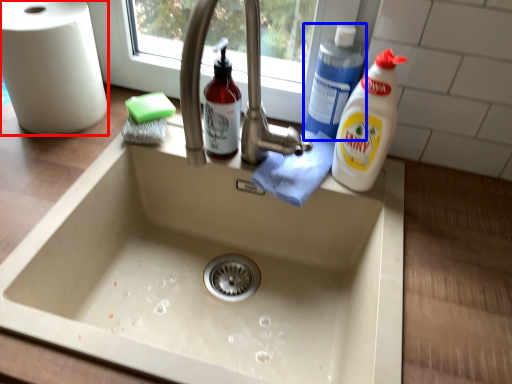
Question: Among these objects, which one is nearest to the camera, paper towel (highlighted by a red box) or cleaning product (highlighted by a blue box)?

Choices:
 (A) paper towel
 (B) cleaning product

Answer: (A)